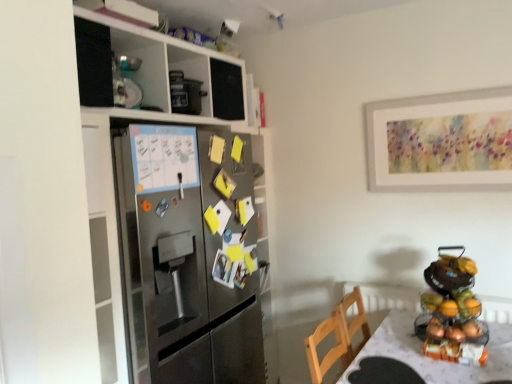
Question: Is metallic fruit stand at right facing away from shiny metallic fruit basket at right?

Choices:
 (A) no
 (B) yes

Answer: (B)

Question: From the image's perspective, is metallic fruit stand at right on shiny metallic fruit basket at right?

Choices:
 (A) no
 (B) yes

Answer: (B)

Question: Is metallic fruit stand at right further to the viewer compared to shiny metallic fruit basket at right?

Choices:
 (A) no
 (B) yes

Answer: (A)

Question: Does metallic fruit stand at right have a larger size compared to shiny metallic fruit basket at right?

Choices:
 (A) yes
 (B) no

Answer: (A)

Question: Is metallic fruit stand at right taller than shiny metallic fruit basket at right?

Choices:
 (A) no
 (B) yes

Answer: (B)

Question: Does metallic fruit stand at right have a lesser width compared to shiny metallic fruit basket at right?

Choices:
 (A) no
 (B) yes

Answer: (A)

Question: Is white textured table at lower right not close to shiny metallic fruit basket at right?

Choices:
 (A) no
 (B) yes

Answer: (A)

Question: From the image's perspective, is white textured table at lower right on top of shiny metallic fruit basket at right?

Choices:
 (A) yes
 (B) no

Answer: (B)

Question: Is white textured table at lower right shorter than shiny metallic fruit basket at right?

Choices:
 (A) no
 (B) yes

Answer: (A)

Question: From the image's perspective, would you say white textured table at lower right is shown under shiny metallic fruit basket at right?

Choices:
 (A) no
 (B) yes

Answer: (B)

Question: Is white textured table at lower right to the right of shiny metallic fruit basket at right from the viewer's perspective?

Choices:
 (A) yes
 (B) no

Answer: (B)

Question: Considering the relative sizes of white textured table at lower right and shiny metallic fruit basket at right in the image provided, is white textured table at lower right wider than shiny metallic fruit basket at right?

Choices:
 (A) yes
 (B) no

Answer: (A)

Question: Could stainless steel refrigerator at left be considered to be inside metallic fruit stand at right?

Choices:
 (A) no
 (B) yes

Answer: (A)